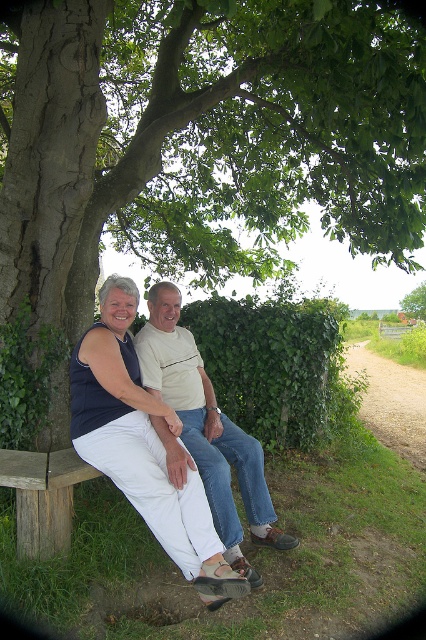
Is matte blue tank top at center bigger than brown wooden bench at lower left?

Correct, matte blue tank top at center is larger in size than brown wooden bench at lower left.

Describe the element at coordinates (141, 445) in the screenshot. This screenshot has width=426, height=640. I see `matte blue tank top at center` at that location.

Where is `matte blue tank top at center`? This screenshot has height=640, width=426. matte blue tank top at center is located at coordinates (141, 445).

Can you confirm if green leafy tree at left is positioned to the right of matte blue tank top at center?

Yes, green leafy tree at left is to the right of matte blue tank top at center.

Does green leafy tree at left have a lesser width compared to matte blue tank top at center?

Correct, green leafy tree at left's width is less than matte blue tank top at center's.

Is point (302, 45) farther from camera compared to point (103, 400)?

Yes.

Find the location of a particular element. The image size is (426, 640). green leafy tree at left is located at coordinates (201, 138).

Does green leafy hedge at center appear under light beige cotton shirt at center?

No.

Which is in front, point (271, 321) or point (187, 456)?

Point (187, 456) is more forward.

Does point (330, 360) come closer to viewer compared to point (199, 451)?

No, it is behind (199, 451).

Find the location of a particular element. The width and height of the screenshot is (426, 640). green leafy hedge at center is located at coordinates (275, 365).